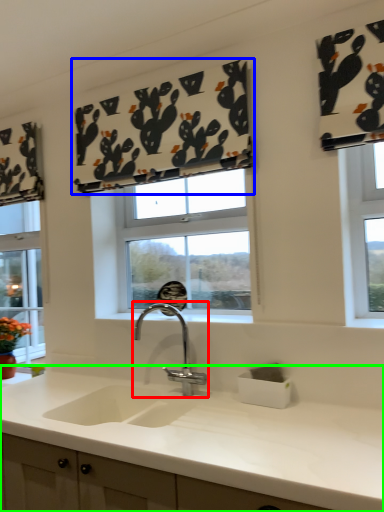
Question: Which object is the farthest from tap (highlighted by a red box)? Choose among these: curtain (highlighted by a blue box) or countertop (highlighted by a green box).

Choices:
 (A) curtain
 (B) countertop

Answer: (A)